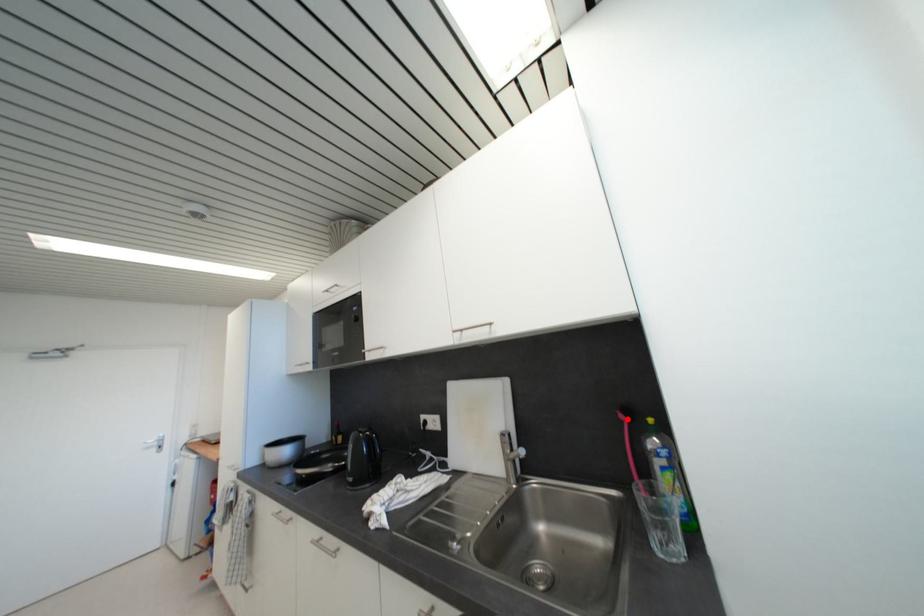
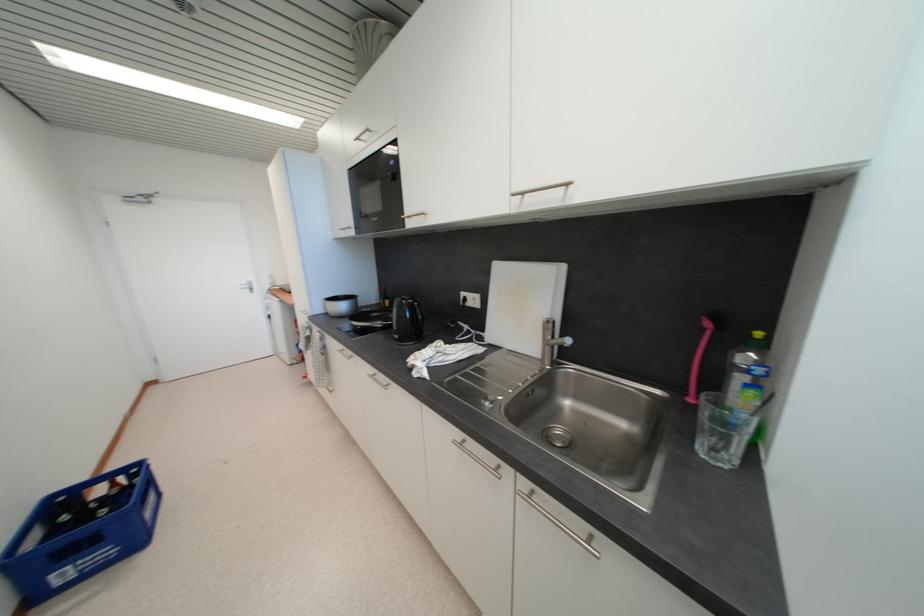
Question: I am providing you with two images of the same scene from different viewpoints. Given a red point in image1, look at the same physical point in image2. Is it:

Choices:
 (A) Closer to the viewpoint
 (B) Farther from the viewpoint

Answer: (A)